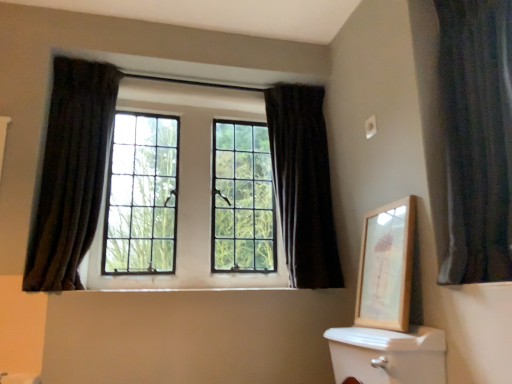
Question: From a real-world perspective, is dark velvet curtain at upper center, marked as the second curtain in a right-to-left arrangement, physically below dark velvet curtain at left, positioned as the 1th curtain in left-to-right order?

Choices:
 (A) yes
 (B) no

Answer: (B)

Question: Is dark velvet curtain at upper center, the 2th curtain viewed from the left, further to camera compared to dark velvet curtain at left, the third curtain positioned from the right?

Choices:
 (A) no
 (B) yes

Answer: (B)

Question: Is dark velvet curtain at upper center, the 2th curtain viewed from the left, looking in the opposite direction of dark velvet curtain at left, positioned as the 1th curtain in left-to-right order?

Choices:
 (A) no
 (B) yes

Answer: (A)

Question: Does dark velvet curtain at upper center, marked as the second curtain in a right-to-left arrangement, have a larger size compared to dark velvet curtain at left, positioned as the 1th curtain in left-to-right order?

Choices:
 (A) yes
 (B) no

Answer: (A)

Question: Is dark velvet curtain at upper center, marked as the second curtain in a right-to-left arrangement, shorter than dark velvet curtain at left, positioned as the 1th curtain in left-to-right order?

Choices:
 (A) no
 (B) yes

Answer: (A)

Question: Does dark velvet curtain at upper center, the 2th curtain viewed from the left, turn towards dark velvet curtain at left, the third curtain positioned from the right?

Choices:
 (A) yes
 (B) no

Answer: (B)

Question: Can you confirm if dark velvet curtain at upper center, marked as the second curtain in a right-to-left arrangement, is bigger than wooden picture frame at upper right?

Choices:
 (A) no
 (B) yes

Answer: (B)

Question: From the image's perspective, is dark velvet curtain at upper center, marked as the second curtain in a right-to-left arrangement, on wooden picture frame at upper right?

Choices:
 (A) yes
 (B) no

Answer: (A)

Question: Does dark velvet curtain at upper center, marked as the second curtain in a right-to-left arrangement, turn towards wooden picture frame at upper right?

Choices:
 (A) no
 (B) yes

Answer: (B)

Question: Considering the relative sizes of dark velvet curtain at upper center, the 2th curtain viewed from the left, and wooden picture frame at upper right in the image provided, is dark velvet curtain at upper center, the 2th curtain viewed from the left, taller than wooden picture frame at upper right?

Choices:
 (A) yes
 (B) no

Answer: (A)

Question: Is dark velvet curtain at upper center, marked as the second curtain in a right-to-left arrangement, positioned beyond the bounds of wooden picture frame at upper right?

Choices:
 (A) yes
 (B) no

Answer: (A)

Question: Is matte glass windows at center smaller than dark velvet curtain at upper center, the 2th curtain viewed from the left?

Choices:
 (A) no
 (B) yes

Answer: (B)